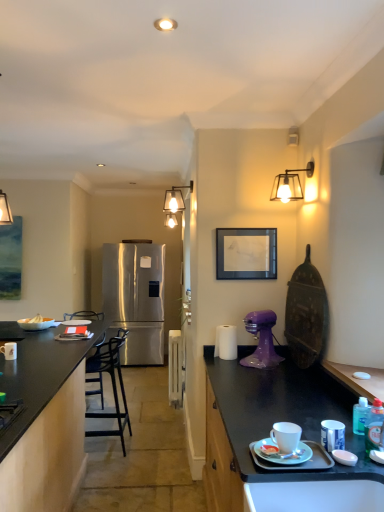
Question: Is stainless steel refrigerator at center oriented away from white matte bowl at left?

Choices:
 (A) no
 (B) yes

Answer: (A)

Question: Is stainless steel refrigerator at center thinner than white matte bowl at left?

Choices:
 (A) no
 (B) yes

Answer: (A)

Question: Is stainless steel refrigerator at center closer to the viewer compared to white matte bowl at left?

Choices:
 (A) yes
 (B) no

Answer: (B)

Question: Would you consider stainless steel refrigerator at center to be distant from white matte bowl at left?

Choices:
 (A) yes
 (B) no

Answer: (A)

Question: Does stainless steel refrigerator at center come behind white matte bowl at left?

Choices:
 (A) yes
 (B) no

Answer: (A)

Question: Could white matte bowl at left be considered to be inside stainless steel refrigerator at center?

Choices:
 (A) yes
 (B) no

Answer: (B)

Question: From the image's perspective, does black metal bar stool at left appear higher than stainless steel refrigerator at center?

Choices:
 (A) yes
 (B) no

Answer: (B)

Question: Is black metal bar stool at left positioned before stainless steel refrigerator at center?

Choices:
 (A) no
 (B) yes

Answer: (B)

Question: Is the position of black metal bar stool at left more distant than that of stainless steel refrigerator at center?

Choices:
 (A) no
 (B) yes

Answer: (A)

Question: Is black metal bar stool at left wider than stainless steel refrigerator at center?

Choices:
 (A) yes
 (B) no

Answer: (B)

Question: From the image's perspective, would you say black metal bar stool at left is shown under stainless steel refrigerator at center?

Choices:
 (A) no
 (B) yes

Answer: (B)

Question: Considering the relative sizes of black metal bar stool at left and stainless steel refrigerator at center in the image provided, is black metal bar stool at left thinner than stainless steel refrigerator at center?

Choices:
 (A) no
 (B) yes

Answer: (B)

Question: Does white glossy book at center, which is the second tableware in front-to-back order, have a smaller size compared to white matte plate at right, which appears as the 1th tableware when viewed from the top?

Choices:
 (A) yes
 (B) no

Answer: (B)